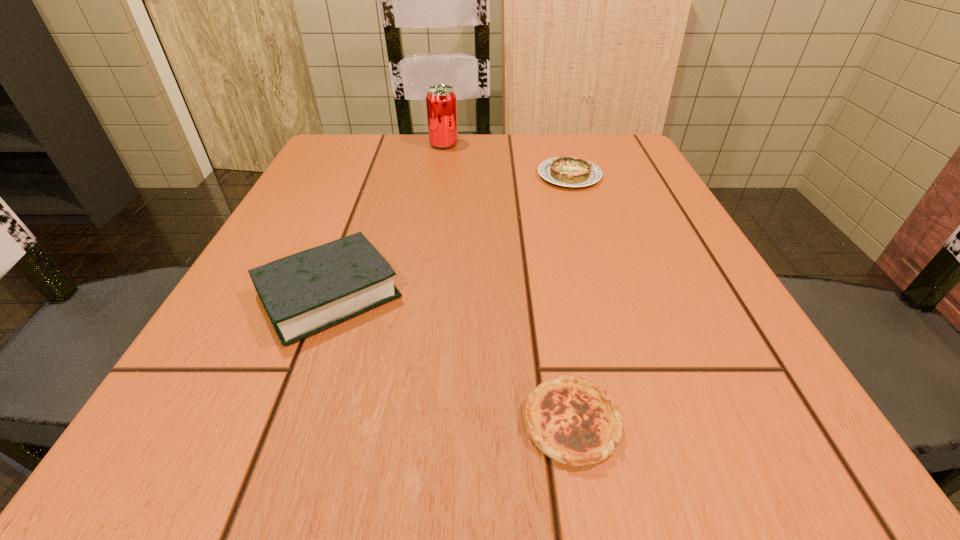
In order to click on vacant space at the far left corner in this screenshot , I will do pos(328,135).

The image size is (960, 540). What are the coordinates of `free space at the far right corner of the desktop` in the screenshot? It's located at (614, 165).

What are the coordinates of `free location at the near right corner` in the screenshot? It's located at (730, 443).

Find the location of a particular element. The image size is (960, 540). empty space that is in between the third farthest object and the nearer quiche is located at coordinates (450, 359).

Find the location of `free space between the third farthest object and the soda can`. free space between the third farthest object and the soda can is located at coordinates (387, 220).

Locate an element on the screen. free spot between the nearest object and the farther quiche is located at coordinates (570, 299).

At what (x,y) coordinates should I click in order to perform the action: click on free space that is in between the second farthest object and the nearest object. Please return your answer as a coordinate pair (x, y). The height and width of the screenshot is (540, 960). Looking at the image, I should click on (570, 299).

Locate an element on the screen. This screenshot has width=960, height=540. vacant space that's between the farther quiche and the Bible is located at coordinates (449, 235).

Identify the location of empty space that is in between the farther quiche and the nearest object. The width and height of the screenshot is (960, 540). (570, 299).

Find the location of a particular element. vacant point located between the farthest object and the farther quiche is located at coordinates (507, 160).